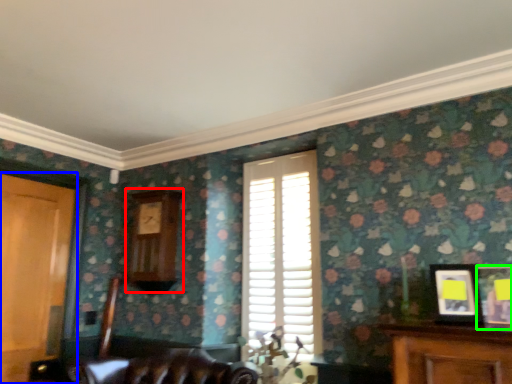
Question: Based on their relative distances, which object is nearer to clock (highlighted by a red box)? Choose from door (highlighted by a blue box) and picture frame (highlighted by a green box).

Choices:
 (A) door
 (B) picture frame

Answer: (A)